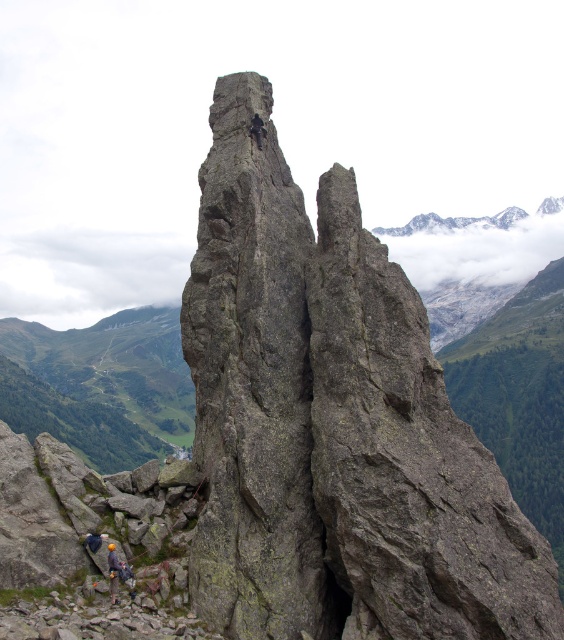
A climber is attempting to reach the top of the gray rough rock at center. The climber is currently at the base. If the climber ascends at a rate of 2.5 meters per minute, how many minutes will it take to reach the top?

The gray rough rock at center is 30.12 meters tall. At a rate of 2.5 meters per minute, the climber will take 30.12 divided by 2.5, which equals approximately 12.05 minutes to reach the top.